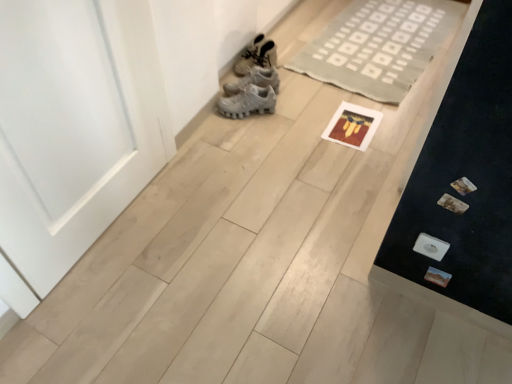
The width and height of the screenshot is (512, 384). Identify the location of free space to the right of white matte door at left. 209,230.